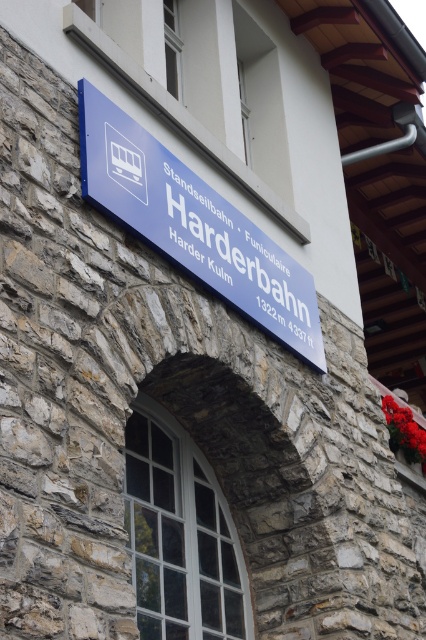
Question: Does blue plastic sign at upper center have a lesser width compared to blue plastic sign at center?

Choices:
 (A) no
 (B) yes

Answer: (A)

Question: Which point is farther to the camera?

Choices:
 (A) blue plastic sign at upper center
 (B) blue plastic sign at center

Answer: (B)

Question: In this image, where is blue plastic sign at upper center located relative to blue plastic sign at center?

Choices:
 (A) right
 (B) left

Answer: (B)

Question: Is blue plastic sign at upper center positioned in front of blue plastic sign at center?

Choices:
 (A) no
 (B) yes

Answer: (B)